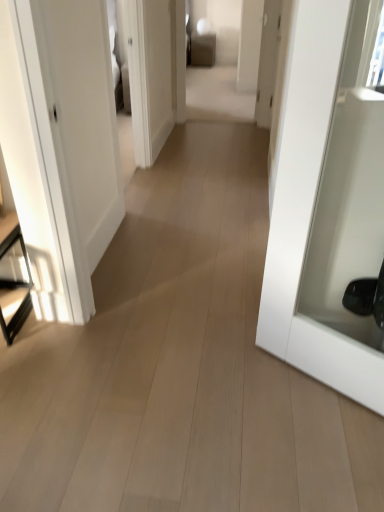
This screenshot has width=384, height=512. Identify the location of free space between white glossy door at right and black glass table at left. (162, 358).